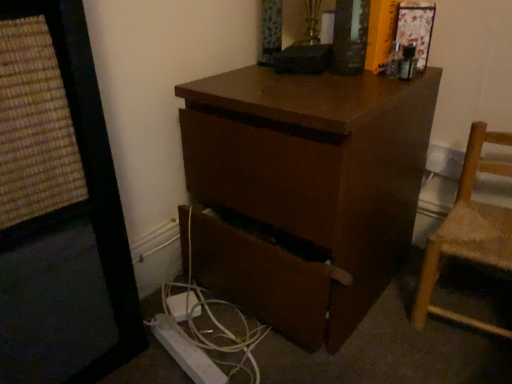
Question: Can you confirm if light brown woven wood chair at right is taller than white plastic cable at lower center?

Choices:
 (A) yes
 (B) no

Answer: (A)

Question: Is light brown woven wood chair at right oriented towards white plastic cable at lower center?

Choices:
 (A) no
 (B) yes

Answer: (A)

Question: Is light brown woven wood chair at right oriented away from white plastic cable at lower center?

Choices:
 (A) no
 (B) yes

Answer: (A)

Question: From the image's perspective, is light brown woven wood chair at right below white plastic cable at lower center?

Choices:
 (A) no
 (B) yes

Answer: (A)

Question: Is light brown woven wood chair at right touching white plastic cable at lower center?

Choices:
 (A) yes
 (B) no

Answer: (B)

Question: From the image's perspective, relative to light brown woven wood chair at right, is brown matte desk at center above or below?

Choices:
 (A) below
 (B) above

Answer: (B)

Question: Is brown matte desk at center taller or shorter than light brown woven wood chair at right?

Choices:
 (A) short
 (B) tall

Answer: (B)

Question: Is point (386, 127) positioned closer to the camera than point (468, 160)?

Choices:
 (A) closer
 (B) farther

Answer: (A)

Question: Considering their positions, is brown matte desk at center located in front of or behind light brown woven wood chair at right?

Choices:
 (A) front
 (B) behind

Answer: (A)

Question: From a real-world perspective, is white plastic cable at lower center above or below brown matte desk at center?

Choices:
 (A) below
 (B) above

Answer: (A)

Question: From the image's perspective, is white plastic cable at lower center above or below brown matte desk at center?

Choices:
 (A) below
 (B) above

Answer: (A)

Question: Is white plastic cable at lower center situated inside brown matte desk at center or outside?

Choices:
 (A) outside
 (B) inside

Answer: (A)

Question: Is point (242, 337) positioned closer to the camera than point (214, 81)?

Choices:
 (A) farther
 (B) closer

Answer: (A)

Question: From the image's perspective, is light brown woven wood chair at right located above or below brown matte desk at center?

Choices:
 (A) above
 (B) below

Answer: (B)

Question: From a real-world perspective, is light brown woven wood chair at right positioned above or below brown matte desk at center?

Choices:
 (A) below
 (B) above

Answer: (A)